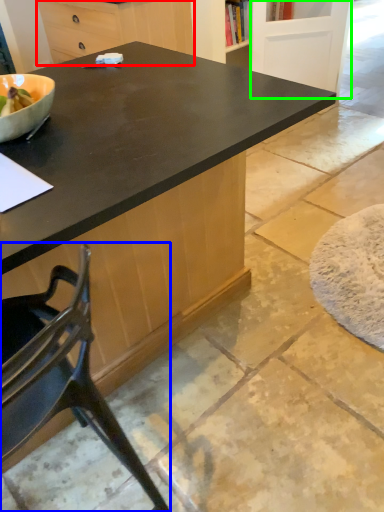
Question: Which is farther away from cabinetry (highlighted by a red box)? chair (highlighted by a blue box) or screen door (highlighted by a green box)?

Choices:
 (A) chair
 (B) screen door

Answer: (A)